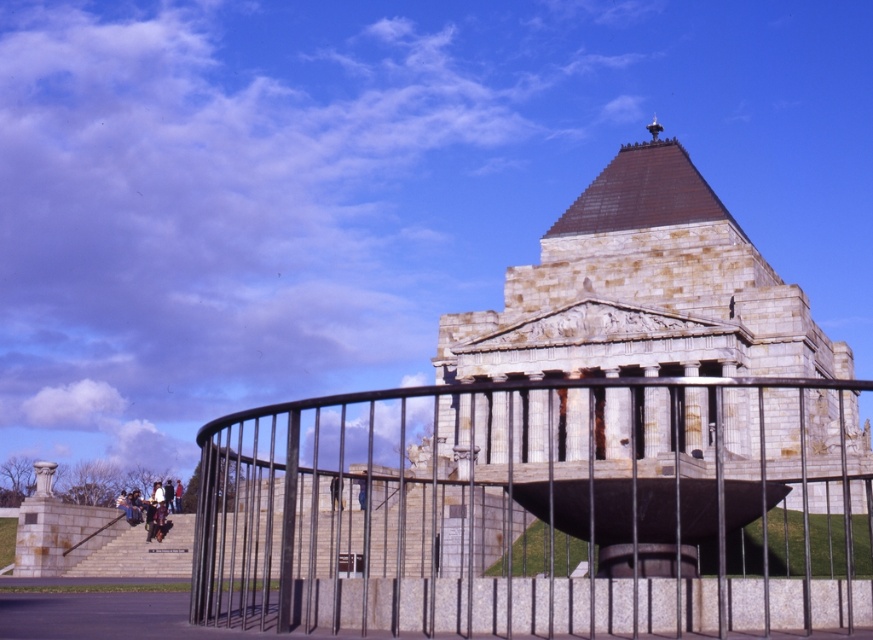
Which is in front, point (727, 292) or point (177, 556)?

Point (177, 556)

The width and height of the screenshot is (873, 640). I want to click on stone/concrete church at center, so click(x=651, y=380).

I want to click on stone/concrete church at center, so click(x=651, y=380).

Is point (322, 582) farther from viewer compared to point (339, 486)?

That is False.

Is metallic black fence at center above dark brown leather jacket at center?

No, metallic black fence at center is not above dark brown leather jacket at center.

This screenshot has width=873, height=640. What are the coordinates of `metallic black fence at center` in the screenshot? It's located at (521, 509).

Who is taller, stone/concrete church at center or dark brown leather jacket at center?

Standing taller between the two is stone/concrete church at center.

Can you confirm if stone/concrete church at center is taller than dark brown leather jacket at center?

Yes.

Is point (754, 404) less distant than point (333, 500)?

That is False.

In order to click on stone/concrete church at center in this screenshot , I will do `click(651, 380)`.